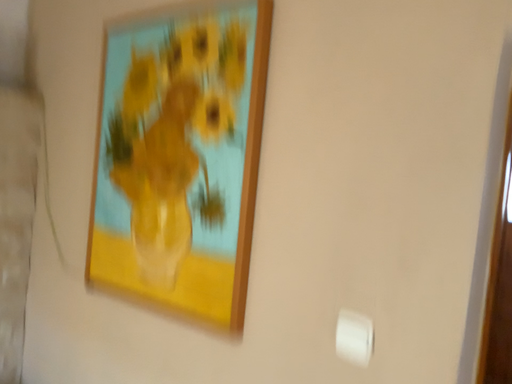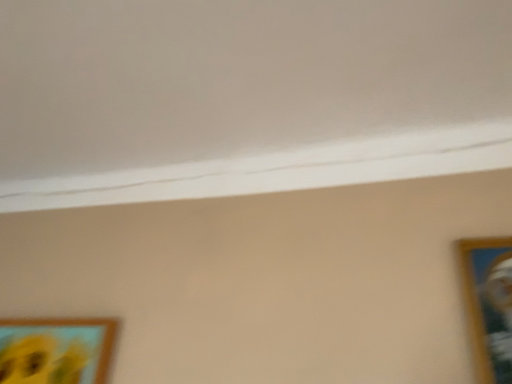
Question: How did the camera likely rotate when shooting the video?

Choices:
 (A) rotated upward
 (B) rotated downward

Answer: (A)